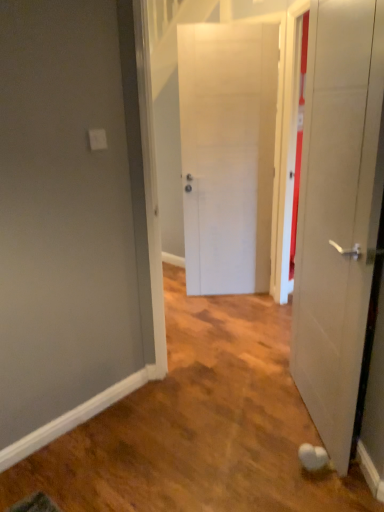
Question: Considering the relative positions of white matte door at right, placed as the second door when sorted from back to front, and white matte door at center, the second door viewed from the front, in the image provided, is white matte door at right, placed as the second door when sorted from back to front, to the left or to the right of white matte door at center, the second door viewed from the front,?

Choices:
 (A) right
 (B) left

Answer: (A)

Question: From the image's perspective, is white matte door at right, marked as the first door in a front-to-back arrangement, positioned above or below white matte door at center, the second door viewed from the front?

Choices:
 (A) below
 (B) above

Answer: (A)

Question: Considering their positions, is white matte door at right, marked as the first door in a front-to-back arrangement, located in front of or behind white matte door at center, the 1th door positioned from the back?

Choices:
 (A) front
 (B) behind

Answer: (A)

Question: Based on their positions, is white matte door at center, the 1th door positioned from the back, located to the left or right of white matte door at right, marked as the first door in a front-to-back arrangement?

Choices:
 (A) left
 (B) right

Answer: (A)

Question: From the image's perspective, is white matte door at center, the second door viewed from the front, above or below white matte door at right, placed as the second door when sorted from back to front?

Choices:
 (A) above
 (B) below

Answer: (A)

Question: From their relative heights in the image, would you say white matte door at center, the 1th door positioned from the back, is taller or shorter than white matte door at right, placed as the second door when sorted from back to front?

Choices:
 (A) short
 (B) tall

Answer: (B)

Question: Relative to white matte door at right, marked as the first door in a front-to-back arrangement, is white matte door at center, the second door viewed from the front, in front or behind?

Choices:
 (A) front
 (B) behind

Answer: (B)